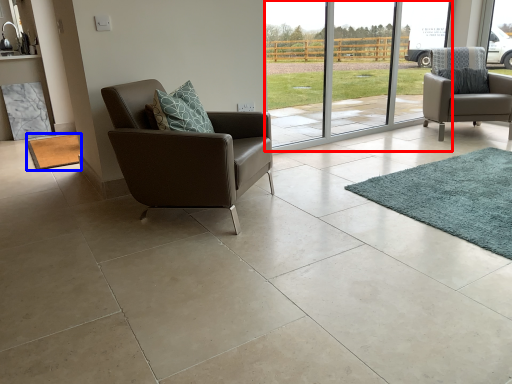
Question: Which point is further to the camera, glass door (highlighted by a red box) or mat (highlighted by a blue box)?

Choices:
 (A) glass door
 (B) mat

Answer: (B)